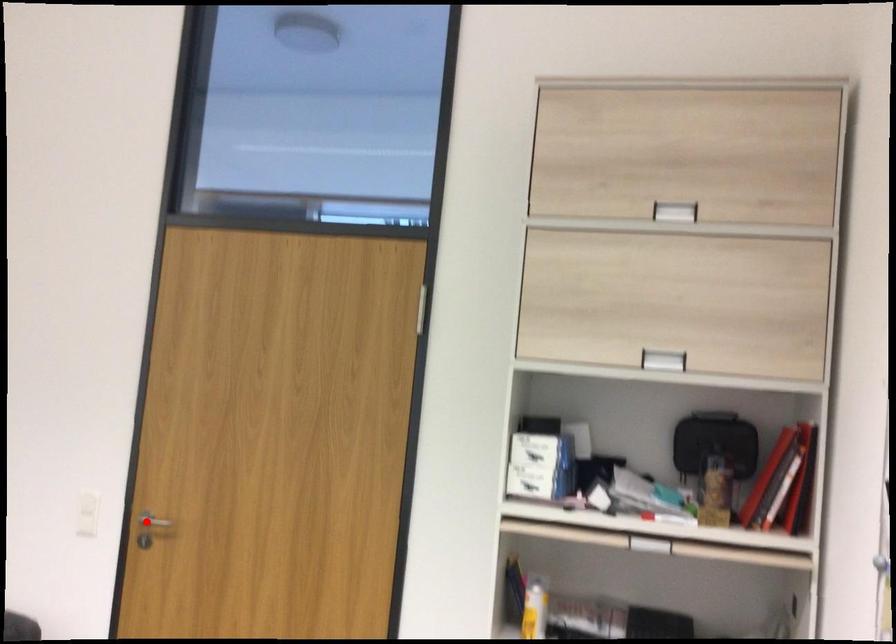
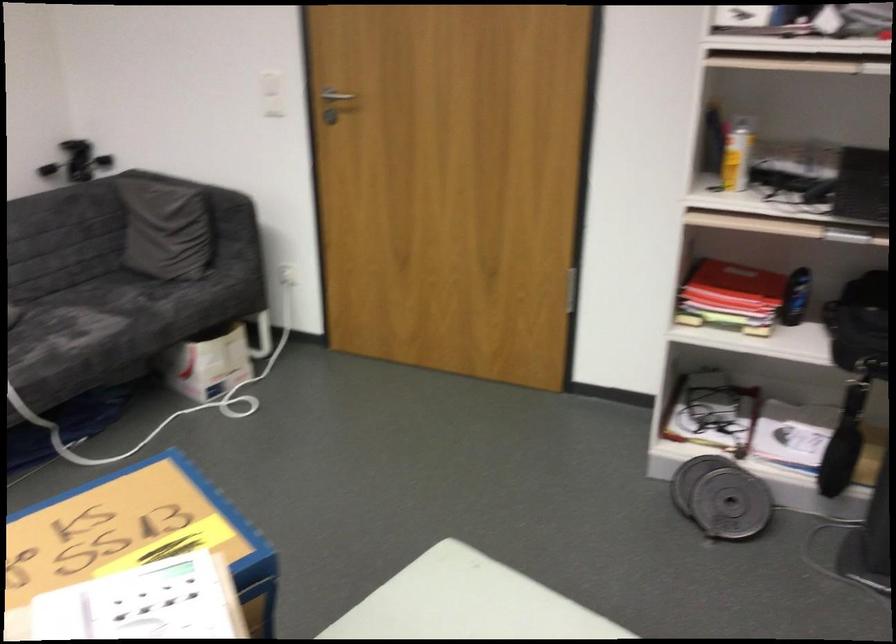
Where in the second image is the point corresponding to the highlighted location from the first image?

(331, 98)